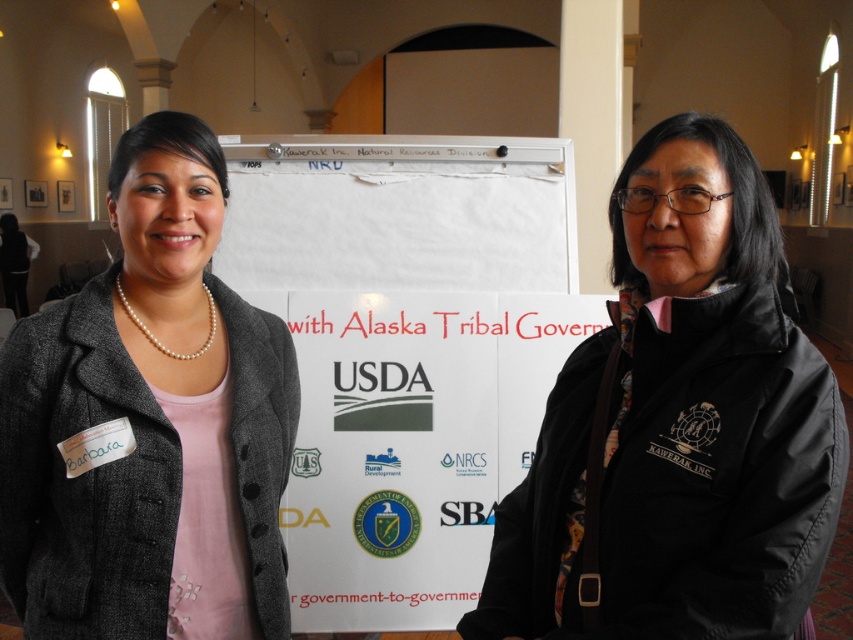
Question: Which point is farther to the camera?

Choices:
 (A) (239, 381)
 (B) (766, 621)

Answer: (A)

Question: Does black matte jacket at center appear under pearl necklace at upper left?

Choices:
 (A) no
 (B) yes

Answer: (B)

Question: Does black matte jacket at center have a larger size compared to pearl necklace at upper left?

Choices:
 (A) yes
 (B) no

Answer: (A)

Question: Which of the following is the farthest from the observer?

Choices:
 (A) black matte jacket at center
 (B) pearl necklace at upper left

Answer: (B)

Question: Does black matte jacket at center have a greater width compared to pearl necklace at upper left?

Choices:
 (A) yes
 (B) no

Answer: (A)